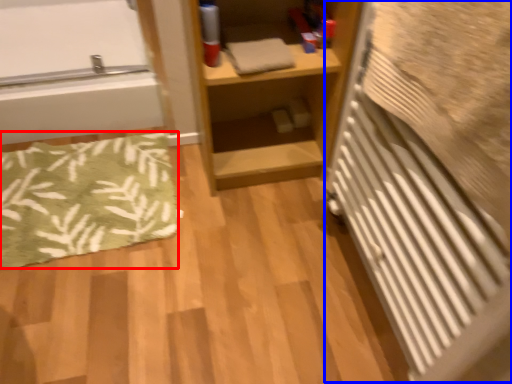
Question: Among these objects, which one is farthest to the camera, bath mat (highlighted by a red box) or radiator (highlighted by a blue box)?

Choices:
 (A) bath mat
 (B) radiator

Answer: (A)